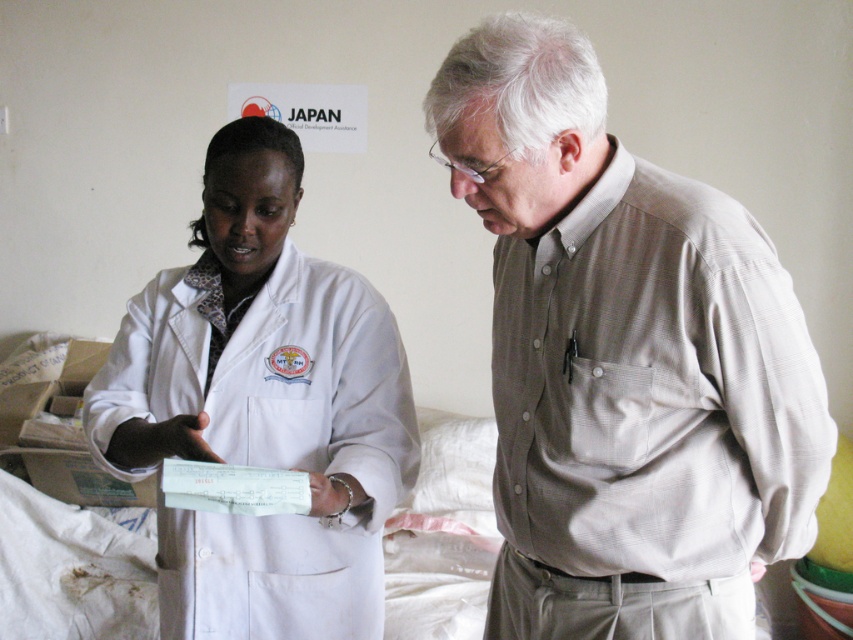
Question: Which point is farther to the camera?

Choices:
 (A) white matte lab coat at center
 (B) white smooth lab coat at center

Answer: (A)

Question: Can you confirm if white smooth lab coat at center is thinner than white matte lab coat at center?

Choices:
 (A) yes
 (B) no

Answer: (A)

Question: Among these points, which one is nearest to the camera?

Choices:
 (A) (761, 502)
 (B) (234, 368)

Answer: (A)

Question: Does white smooth lab coat at center come behind white matte lab coat at center?

Choices:
 (A) yes
 (B) no

Answer: (B)

Question: Does white smooth lab coat at center have a greater width compared to white matte lab coat at center?

Choices:
 (A) no
 (B) yes

Answer: (A)